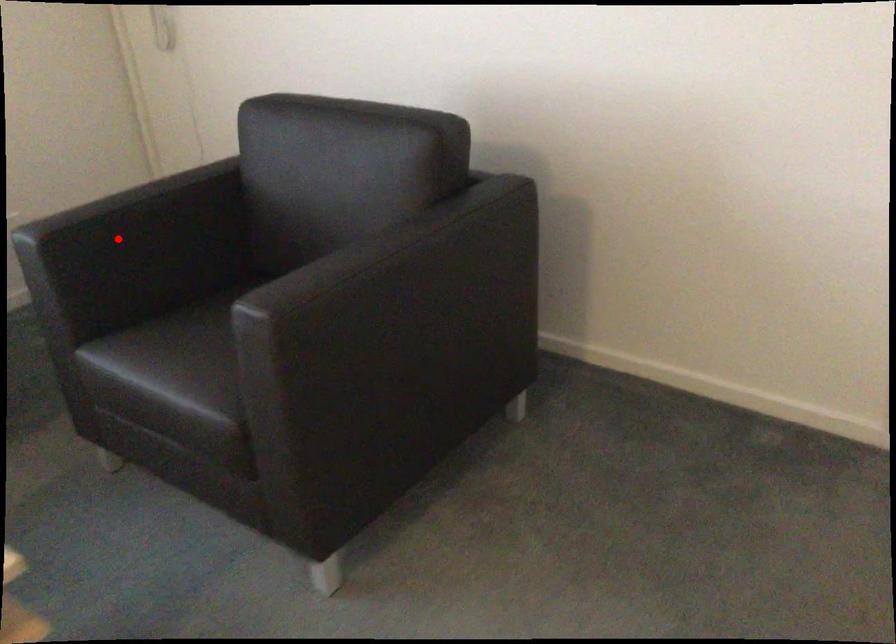
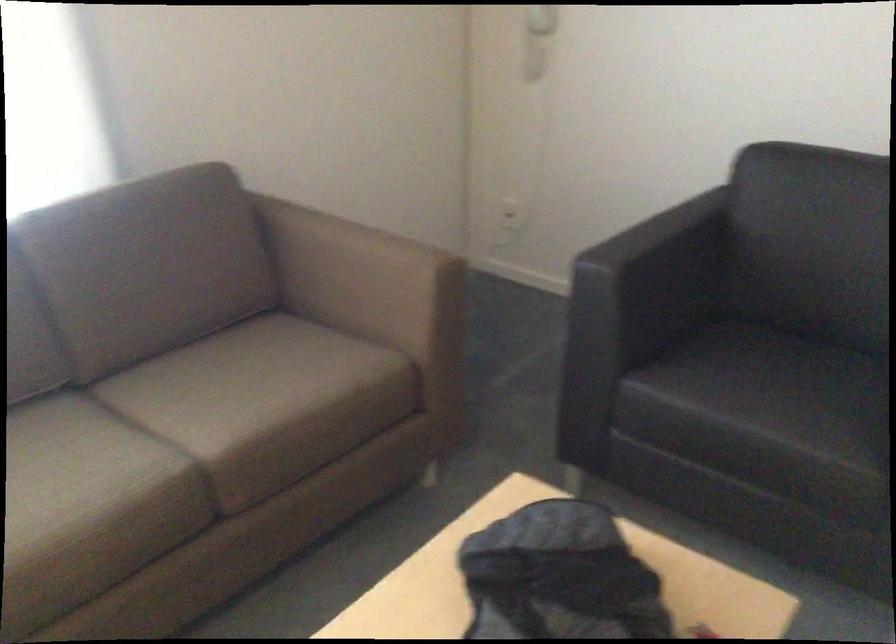
Where in the second image is the point corresponding to the highlighted location from the first image?

(652, 270)